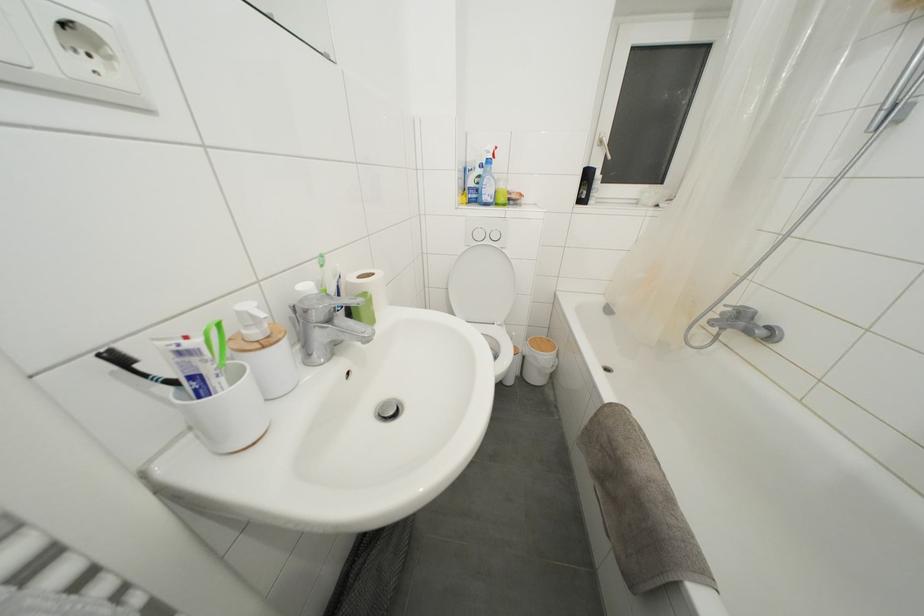
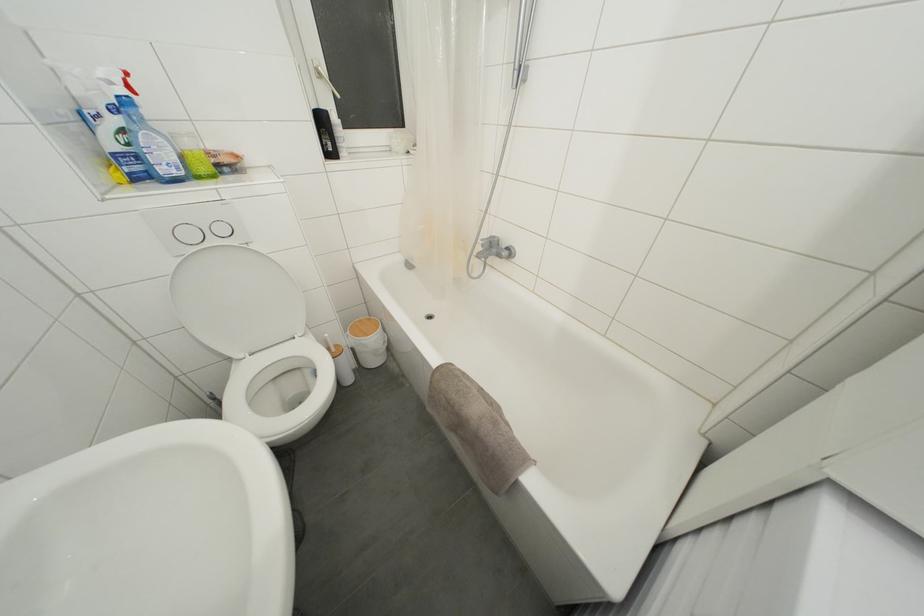
Locate, in the second image, the point that corresponds to (x=483, y=240) in the first image.

(195, 240)